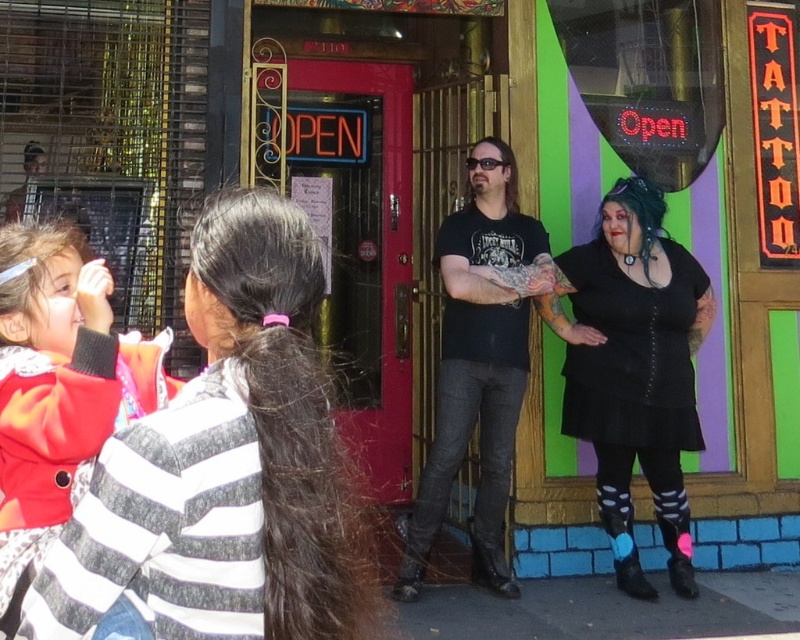
You are a delivery person who needs to hand a package to the person wearing the striped sweater at center. You are currently standing next to the matte red jacket at left. Can you reach the person without moving more than 24 inches?

The distance between the striped sweater at center and the matte red jacket at left is 24.70 inches. Since you need to move less than 24 inches, you cannot reach them without moving further.